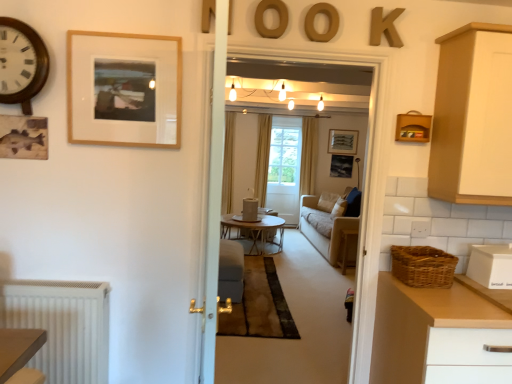
The width and height of the screenshot is (512, 384). What do you see at coordinates (490, 266) in the screenshot? I see `white matte container at right` at bounding box center [490, 266].

The image size is (512, 384). Find the location of `wooden round table at center`. wooden round table at center is located at coordinates (346, 246).

Image resolution: width=512 pixels, height=384 pixels. Describe the element at coordinates (346, 246) in the screenshot. I see `wooden round table at center` at that location.

At what (x,y) coordinates should I click in order to perform the action: click on wooden round coffee table at center. Please return your answer as a coordinate pair (x, y). The width and height of the screenshot is (512, 384). Looking at the image, I should click on (255, 232).

Would you say white matte container at right is outside neutral beige carpet at center?

Yes.

Can you confirm if white matte container at right is positioned to the left of neutral beige carpet at center?

In fact, white matte container at right is to the right of neutral beige carpet at center.

From the image's perspective, is white matte container at right above or below neutral beige carpet at center?

From the image's perspective, white matte container at right appears below neutral beige carpet at center.

Which is behind, white matte container at right or neutral beige carpet at center?

neutral beige carpet at center is more distant.

Locate an element on the screen. Image resolution: width=512 pixels, height=384 pixels. clock that is above the wooden picture frame at center, which appears as the 3th picture frame when viewed from the left (from a real-world perspective) is located at coordinates (21, 63).

Is wooden clock at upper left wider than wooden picture frame at center, which appears as the 3th picture frame when viewed from the left?

Yes, wooden clock at upper left is wider than wooden picture frame at center, which appears as the 3th picture frame when viewed from the left.

From a real-world perspective, is wooden clock at upper left on wooden picture frame at center, the first picture frame in the right-to-left sequence?

Yes, from a real-world perspective, wooden clock at upper left is over wooden picture frame at center, the first picture frame in the right-to-left sequence

Is white wooden door at center located within suede gray armchair at center?

No, white wooden door at center is located outside of suede gray armchair at center.

Is white wooden door at center at the back of suede gray armchair at center?

No, white wooden door at center is not at the back of suede gray armchair at center.

Is point (233, 261) behind point (220, 156)?

Yes.

Which object is more forward, suede gray armchair at center or white wooden door at center?

Positioned in front is white wooden door at center.

How many degrees apart are the facing directions of wooden picture frame at upper left, positioned as the 1th picture frame in left-to-right order, and wooden letter k at upper right, the first letter in the right-to-left sequence?

There is a 0.0276-degree angle between the facing directions of wooden picture frame at upper left, positioned as the 1th picture frame in left-to-right order, and wooden letter k at upper right, the first letter in the right-to-left sequence.

Which of these two, wooden picture frame at upper left, positioned as the 1th picture frame in left-to-right order, or wooden letter k at upper right, the fourth letter in the left-to-right sequence, is wider?

wooden letter k at upper right, the fourth letter in the left-to-right sequence, is wider.

Could you tell me if wooden picture frame at upper left, marked as the 3th picture frame in a right-to-left arrangement, is facing wooden letter k at upper right, the fourth letter in the left-to-right sequence?

No, wooden picture frame at upper left, marked as the 3th picture frame in a right-to-left arrangement, does not turn towards wooden letter k at upper right, the fourth letter in the left-to-right sequence.

Is wooden picture frame at upper left, the 1th picture frame when ordered from front to back, not within wooden letter k at upper right, the fourth letter in the left-to-right sequence?

Yes, wooden picture frame at upper left, the 1th picture frame when ordered from front to back, is located beyond the bounds of wooden letter k at upper right, the fourth letter in the left-to-right sequence.

Does point (269, 31) come in front of point (344, 241)?

Yes, it is.

Considering the sizes of objects wooden letter at upper center, which is the third letter in right-to-left order, and light gray fabric couch at center in the image provided, who is thinner, wooden letter at upper center, which is the third letter in right-to-left order, or light gray fabric couch at center?

Thinner between the two is wooden letter at upper center, which is the third letter in right-to-left order.

Who is bigger, wooden letter at upper center, which appears as the 1th letter when viewed from the left, or clear glass window at center?

With larger size is clear glass window at center.

Is wooden letter at upper center, positioned as the 4th letter in right-to-left order, not near clear glass window at center?

wooden letter at upper center, positioned as the 4th letter in right-to-left order, is positioned a significant distance from clear glass window at center.

How different are the orientations of wooden letter at upper center, positioned as the 4th letter in right-to-left order, and clear glass window at center in degrees?

There is a 0.999-degree angle between the facing directions of wooden letter at upper center, positioned as the 4th letter in right-to-left order, and clear glass window at center.

Based on the photo, is wooden letter at upper center, which appears as the 1th letter when viewed from the left, to the left or to the right of clear glass window at center in the image?

In the image, wooden letter at upper center, which appears as the 1th letter when viewed from the left, appears on the left side of clear glass window at center.

Identify the location of clock lying in front of the wooden picture frame at upper left, the 1th picture frame when ordered from front to back. point(21,63).

Is point (3, 57) positioned after point (166, 138)?

No, (3, 57) is in front of (166, 138).

In terms of height, does wooden clock at upper left look taller or shorter compared to wooden picture frame at upper left, arranged as the 3th picture frame when viewed from the back?

In the image, wooden clock at upper left appears to be shorter than wooden picture frame at upper left, arranged as the 3th picture frame when viewed from the back.

At what (x,y) coordinates should I click in order to perform the action: click on corridor to the left of white matte container at right. Please return your answer as a coordinate pair (x, y). The height and width of the screenshot is (384, 512). Looking at the image, I should click on (364, 190).

Identify the location of picture frame located above the wooden clock at upper left (from the image's perspective). This screenshot has width=512, height=384. (343, 141).

Looking at the image, which one is located further to wooden clock at upper left, white wood cabinet at right or wooden letter at upper center, which is the 2th letter in left-to-right order?

white wood cabinet at right.

Which object lies further to the anchor point wooden letter k at upper right, the fourth letter in the left-to-right sequence, clear glass window at center or white matte container at right?

clear glass window at center.

Considering their positions, is brown matte letter o at upper center, the 3th letter positioned from the left, positioned closer to wooden round table at center than light gray fabric couch at center?

light gray fabric couch at center is closer to wooden round table at center.

Based on their spatial positions, is white matte radiator at lower left or white matte container at right closer to wooden round table at center?

Among the two, white matte container at right is located nearer to wooden round table at center.

When comparing their distances from wooden clock at upper left, does white matte radiator at lower left or light gray fabric couch at center seem further?

light gray fabric couch at center is further to wooden clock at upper left.

Based on the photo, considering their positions, is matte black picture frame at center, the 2th picture frame in the right-to-left sequence, positioned further to brown matte letter o at upper center, which is the second letter from right to left, than suede gray armchair at center?

matte black picture frame at center, the 2th picture frame in the right-to-left sequence.

From the picture: From the image, which object appears to be farther from white wooden door at center, white matte chest of drawers at right or woven basket at right?

Based on the image, woven basket at right appears to be further to white wooden door at center.

Based on their spatial positions, is wooden round table at center or white matte radiator at lower left further from wooden clock at upper left?

wooden round table at center is positioned further to the anchor wooden clock at upper left.

Locate an element on the screen. plain between wooden clock at upper left and wooden round table at center from front to back is located at coordinates (297, 326).

Identify the location of radiator located between wooden clock at upper left and wooden picture frame at center, the 2th picture frame from the back, in the depth direction. (62, 326).

Where is `basket between white wood cabinet at right and light gray fabric couch at center in the front-back direction`? This screenshot has height=384, width=512. basket between white wood cabinet at right and light gray fabric couch at center in the front-back direction is located at coordinates [423, 266].

You are a GUI agent. You are given a task and a screenshot of the screen. Output one action in this format:
    pyautogui.click(x=<x>, y=<y>)
    Task: Click on the corridor between white wooden door at center and white matte container at right in the horizontal direction
    The height and width of the screenshot is (384, 512).
    Given the screenshot: What is the action you would take?
    pyautogui.click(x=364, y=190)